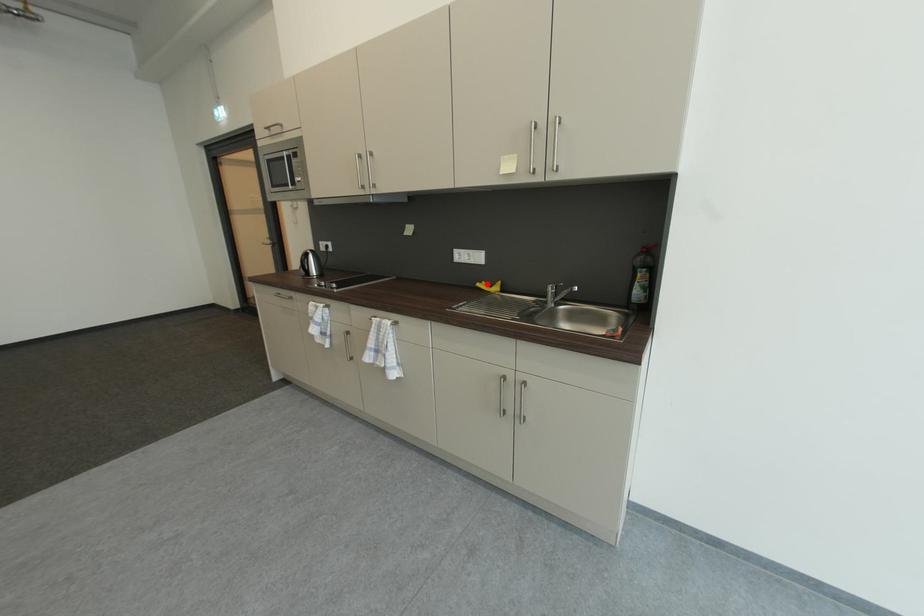
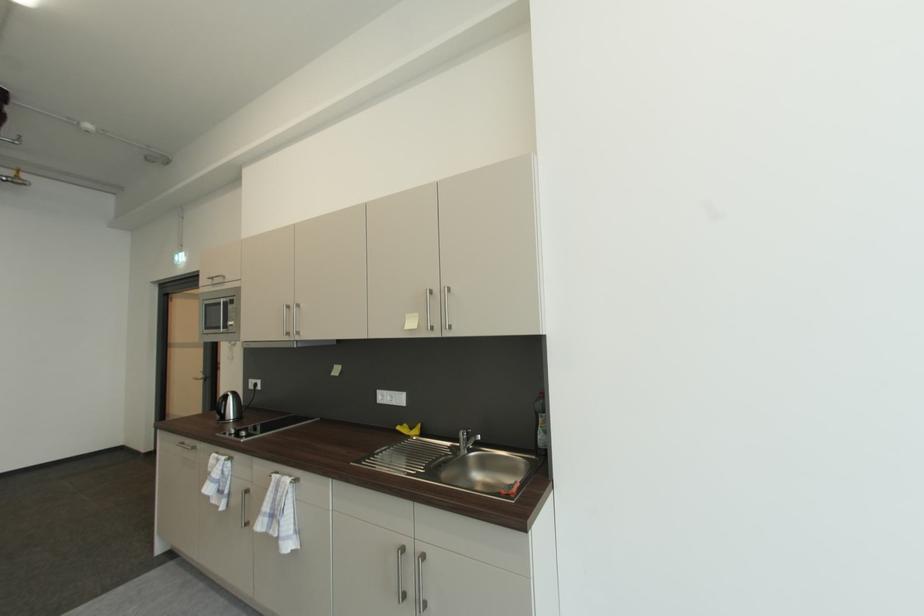
Question: I am providing you with two images of the same scene from different viewpoints. Image1 has a red point marked. In image2, the corresponding 3D location appears at what relative position? Reply with the corresponding letter.

Choices:
 (A) Closer
 (B) Farther

Answer: (B)